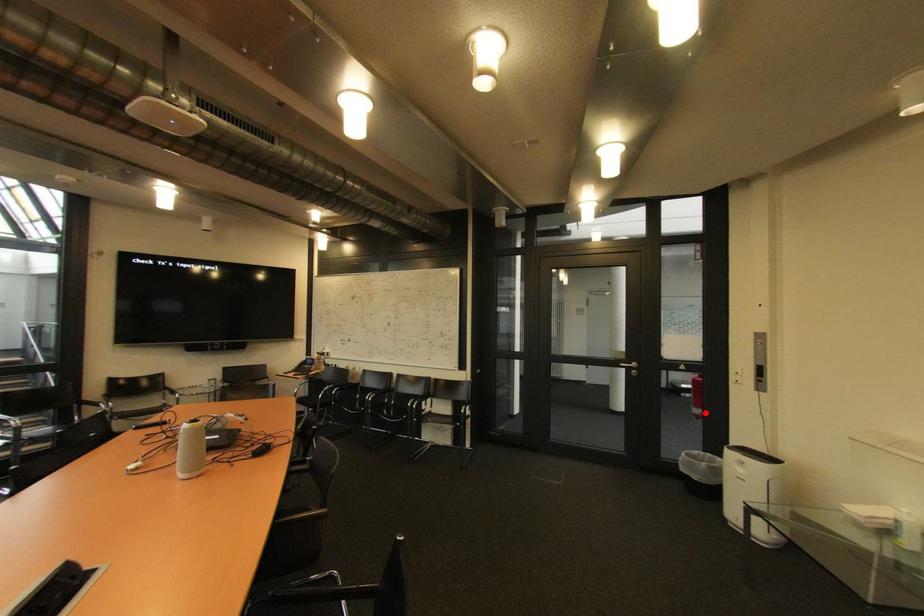
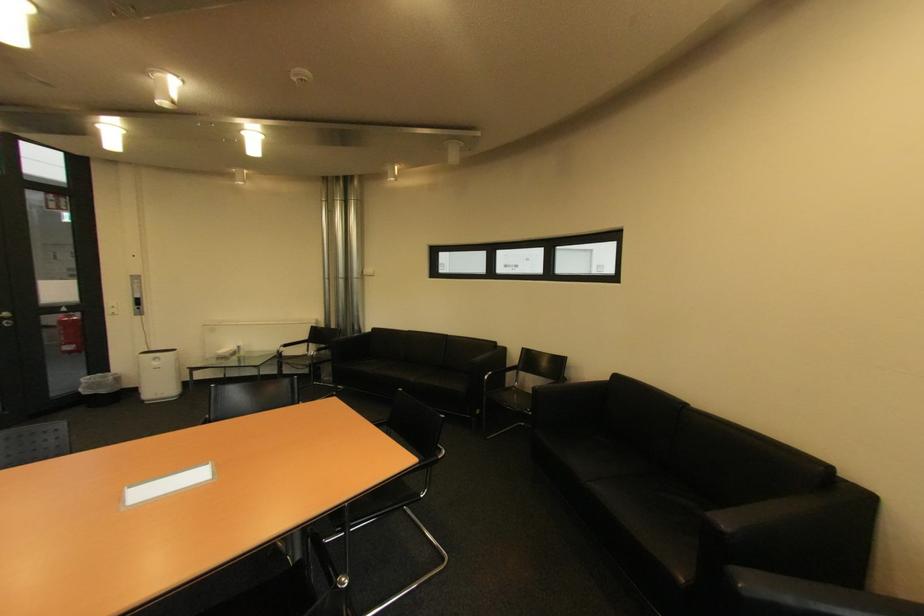
Where in the second image is the point corresponding to the highlighted location from the first image?

(79, 349)